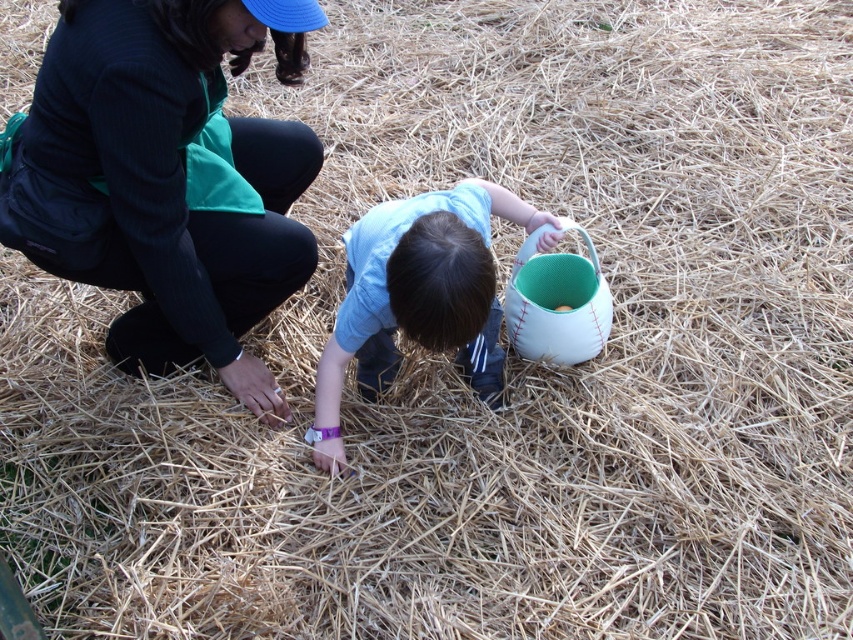
You are standing at the point marked by coordinates (167, 179) in the image. Looking around, you see a green fabric jacket at upper left and a child reaching into the straw. Which direction should you move to get closer to the child?

The point marked by coordinates (167, 179) is at the green fabric jacket at upper left. To get closer to the child, you should move downward and to the right since the child is positioned lower and to the right relative to the jacket.

Looking at this image, you are standing in a field with the green fabric jacket at upper left and the light blue fabric shirt at center. Which person is closer to you?

The green fabric jacket at upper left is closer to the viewer than the light blue fabric shirt at center.